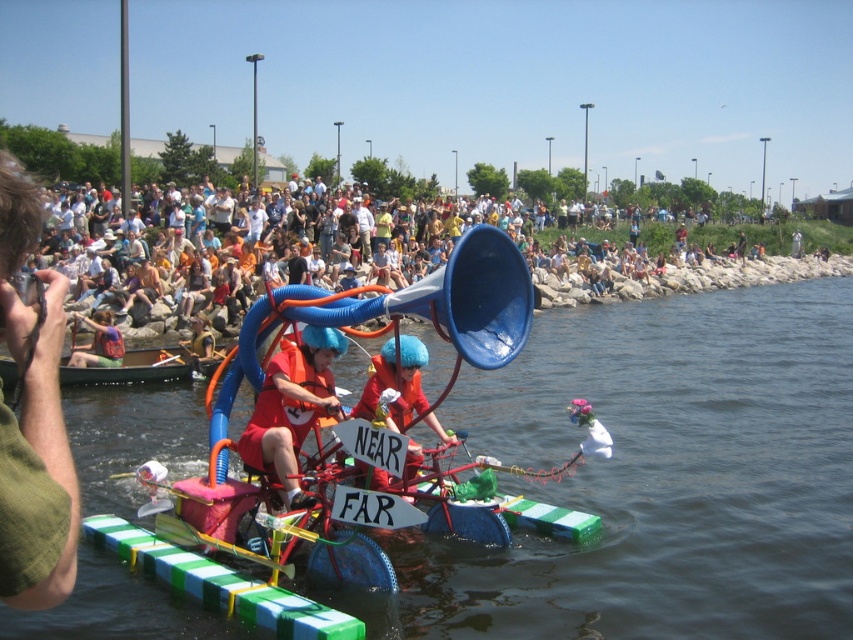
Between green plastic boat at center and red fabric life vest at center, which one appears on the right side from the viewer's perspective?

Positioned to the right is green plastic boat at center.

Can you confirm if green plastic boat at center is positioned to the left of red fabric life vest at center?

In fact, green plastic boat at center is to the right of red fabric life vest at center.

Is point (769, 333) closer to camera compared to point (283, 417)?

No, (769, 333) is further to viewer.

Find the location of a particular element. This screenshot has width=853, height=640. green plastic boat at center is located at coordinates (659, 476).

Does red fabric life vest at center have a greater height compared to red fabric boat at center?

Yes.

Which is above, red fabric life vest at center or red fabric boat at center?

red fabric boat at center is higher up.

Measure the distance between red fabric life vest at center and camera.

A distance of 66.89 feet exists between red fabric life vest at center and camera.

This screenshot has height=640, width=853. Find the location of `red fabric life vest at center`. red fabric life vest at center is located at coordinates (292, 406).

Does green fabric hand at upper left come behind red fabric boat at center?

No, it is in front of red fabric boat at center.

Is green fabric hand at upper left bigger than red fabric boat at center?

No.

Identify the location of green fabric hand at upper left. (33, 419).